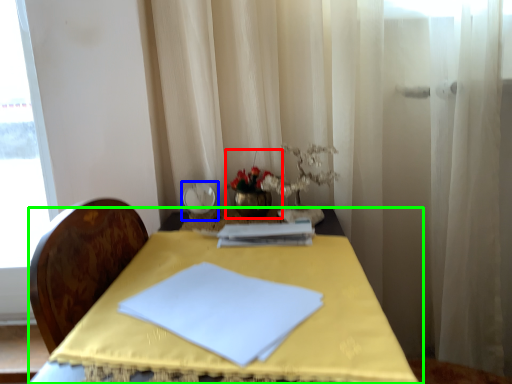
Question: Which is farther away from floral arrangement (highlighted by a red box)? tableware (highlighted by a blue box) or table (highlighted by a green box)?

Choices:
 (A) tableware
 (B) table

Answer: (B)